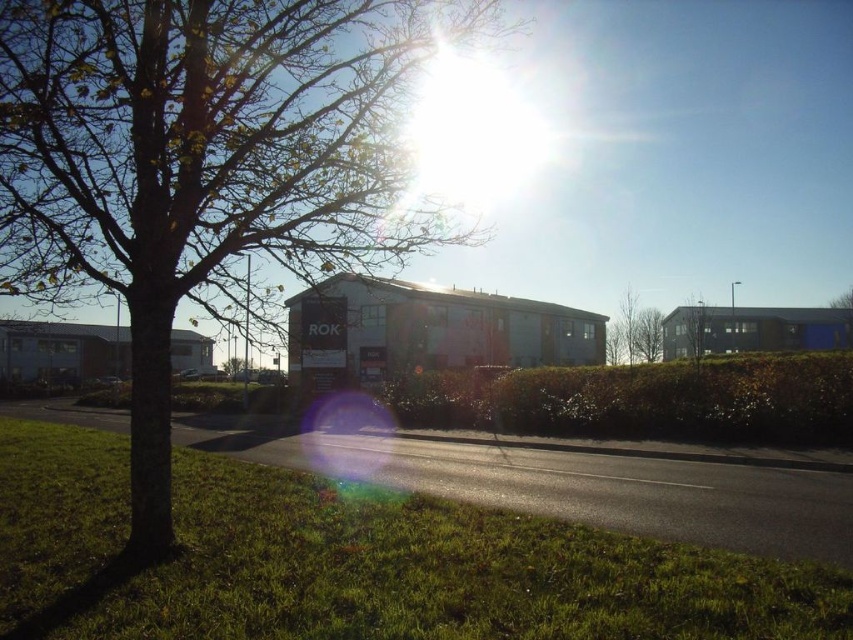
Is point (630, 308) farther from camera compared to point (683, 317)?

Yes, point (630, 308) is behind point (683, 317).

Which is above, green leafy tree at upper center or green leafy tree at center?

green leafy tree at upper center

Image resolution: width=853 pixels, height=640 pixels. Find the location of `green leafy tree at upper center`. green leafy tree at upper center is located at coordinates (634, 332).

Locate an element on the screen. green leafy tree at upper center is located at coordinates (634, 332).

Which is more to the right, brown bark tree at center or green grass at lower left?

From the viewer's perspective, green grass at lower left appears more on the right side.

Is point (149, 483) more distant than point (117, 508)?

No, (149, 483) is closer to viewer.

I want to click on brown bark tree at center, so click(206, 163).

Can you confirm if brown bark tree at center is wider than green leafy tree at center?

In fact, brown bark tree at center might be narrower than green leafy tree at center.

Who is taller, brown bark tree at center or green leafy tree at center?

Standing taller between the two is brown bark tree at center.

Describe the element at coordinates (206, 163) in the screenshot. The width and height of the screenshot is (853, 640). I see `brown bark tree at center` at that location.

The height and width of the screenshot is (640, 853). I want to click on brown bark tree at center, so click(x=206, y=163).